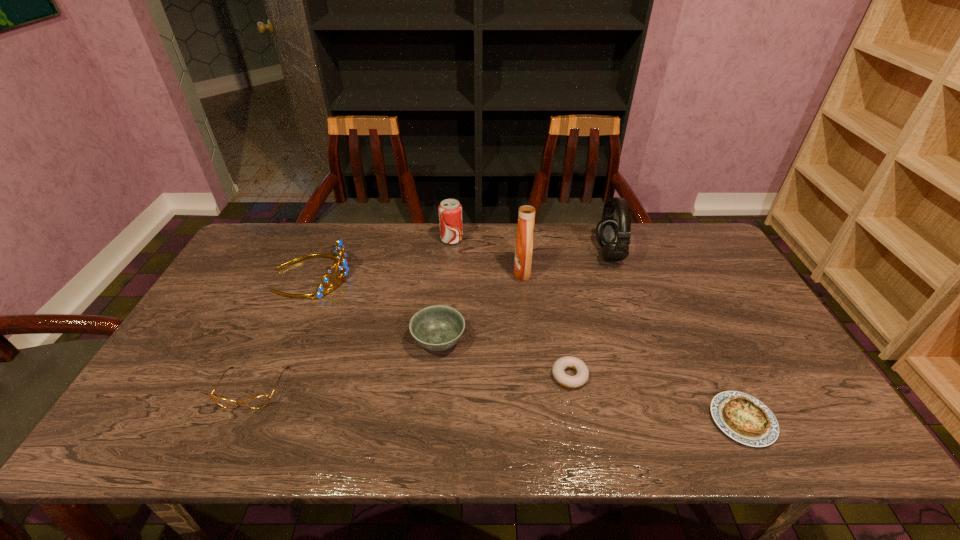
The width and height of the screenshot is (960, 540). What are the coordinates of `free spot located on the front-facing side of the fourth object from right to left` in the screenshot? It's located at (389, 271).

This screenshot has width=960, height=540. What are the coordinates of `free location located 0.270m on the front-facing side of the fourth object from right to left` in the screenshot? It's located at click(x=429, y=271).

I want to click on vacant space located on the front-facing side of the fourth object from right to left, so click(x=454, y=271).

I want to click on vacant space located 0.170m on the earcups of the second object from right to left, so click(x=546, y=254).

The width and height of the screenshot is (960, 540). Identify the location of vacant space located on the earcups of the second object from right to left. coord(546,254).

The width and height of the screenshot is (960, 540). Find the location of `free space located on the earcups of the second object from right to left`. free space located on the earcups of the second object from right to left is located at coordinates (492, 254).

At what (x,y) coordinates should I click in order to perform the action: click on blank area located 0.080m on the left of the soda can. Please return your answer as a coordinate pair (x, y). Image resolution: width=960 pixels, height=540 pixels. Looking at the image, I should click on (418, 239).

Find the location of a particular element. The height and width of the screenshot is (540, 960). vacant area located 0.260m on the front-facing side of the tiara is located at coordinates (432, 275).

The width and height of the screenshot is (960, 540). I want to click on free space located on the left of the bowl, so click(323, 341).

Where is `free space located on the back of the third object from right to left`? The height and width of the screenshot is (540, 960). free space located on the back of the third object from right to left is located at coordinates (554, 291).